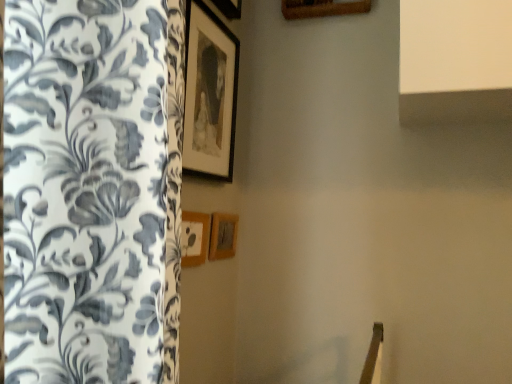
Question: In which direction should I rotate to look at wooden picture frame at center, which ranks as the second picture frame in top-to-bottom order?

Choices:
 (A) right
 (B) left

Answer: (B)

Question: Is there a large distance between matte black picture frame at upper center, which is the first picture frame in top-to-bottom order, and wooden picture frame at center, which is the third picture frame from top to bottom?

Choices:
 (A) yes
 (B) no

Answer: (B)

Question: Considering the relative sizes of matte black picture frame at upper center, which is the first picture frame in top-to-bottom order, and wooden picture frame at center, the 1th picture frame in the bottom-to-top sequence, in the image provided, is matte black picture frame at upper center, which is the first picture frame in top-to-bottom order, taller than wooden picture frame at center, the 1th picture frame in the bottom-to-top sequence,?

Choices:
 (A) no
 (B) yes

Answer: (B)

Question: Considering the relative sizes of matte black picture frame at upper center, the 3th picture frame ordered from the bottom, and wooden picture frame at center, the 1th picture frame in the bottom-to-top sequence, in the image provided, is matte black picture frame at upper center, the 3th picture frame ordered from the bottom, shorter than wooden picture frame at center, the 1th picture frame in the bottom-to-top sequence,?

Choices:
 (A) no
 (B) yes

Answer: (A)

Question: Considering the relative sizes of matte black picture frame at upper center, the 3th picture frame ordered from the bottom, and wooden picture frame at center, which is the third picture frame from top to bottom, in the image provided, is matte black picture frame at upper center, the 3th picture frame ordered from the bottom, thinner than wooden picture frame at center, which is the third picture frame from top to bottom,?

Choices:
 (A) yes
 (B) no

Answer: (B)

Question: From the image's perspective, does matte black picture frame at upper center, the 3th picture frame ordered from the bottom, appear lower than wooden picture frame at center, the 1th picture frame in the bottom-to-top sequence?

Choices:
 (A) yes
 (B) no

Answer: (B)

Question: Are matte black picture frame at upper center, which is the first picture frame in top-to-bottom order, and wooden picture frame at center, which is the third picture frame from top to bottom, beside each other?

Choices:
 (A) no
 (B) yes

Answer: (A)

Question: Does wooden picture frame at center, which is the 2th picture frame in bottom-to-top order, have a lesser height compared to matte black picture frame at upper center, the 3th picture frame ordered from the bottom?

Choices:
 (A) no
 (B) yes

Answer: (B)

Question: Is wooden picture frame at center, which ranks as the second picture frame in top-to-bottom order, not within matte black picture frame at upper center, which is the first picture frame in top-to-bottom order?

Choices:
 (A) no
 (B) yes

Answer: (B)

Question: From the image's perspective, is wooden picture frame at center, which ranks as the second picture frame in top-to-bottom order, beneath matte black picture frame at upper center, which is the first picture frame in top-to-bottom order?

Choices:
 (A) yes
 (B) no

Answer: (A)

Question: Can you confirm if wooden picture frame at center, which is the 2th picture frame in bottom-to-top order, is thinner than matte black picture frame at upper center, which is the first picture frame in top-to-bottom order?

Choices:
 (A) no
 (B) yes

Answer: (B)

Question: From the image's perspective, would you say wooden picture frame at center, which is the 2th picture frame in bottom-to-top order, is positioned over matte black picture frame at upper center, which is the first picture frame in top-to-bottom order?

Choices:
 (A) yes
 (B) no

Answer: (B)

Question: Is wooden picture frame at center, which ranks as the second picture frame in top-to-bottom order, far away from matte black picture frame at upper center, which is the first picture frame in top-to-bottom order?

Choices:
 (A) yes
 (B) no

Answer: (B)

Question: Could you tell me if matte black picture frame at upper center, which is the first picture frame in top-to-bottom order, is facing wooden picture frame at center, which ranks as the second picture frame in top-to-bottom order?

Choices:
 (A) no
 (B) yes

Answer: (A)